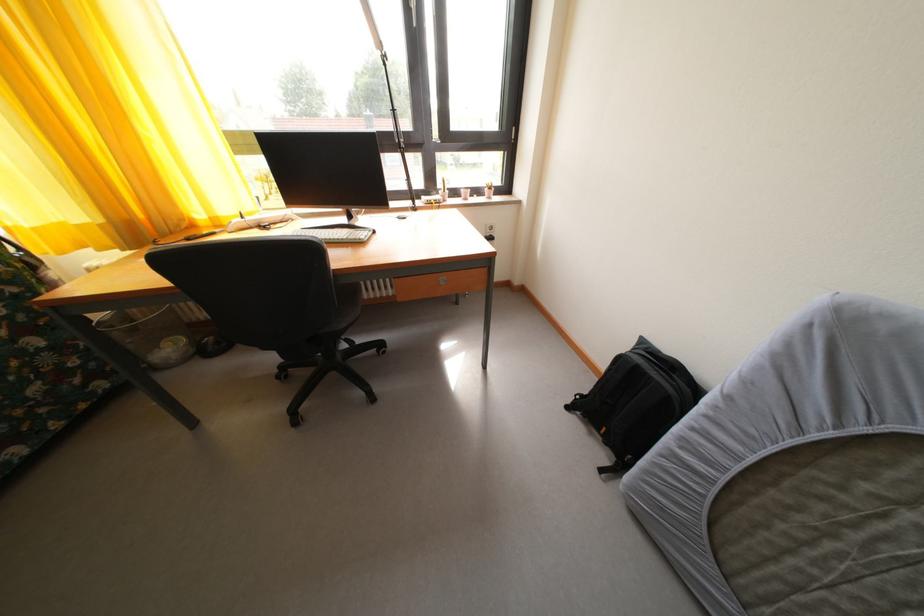
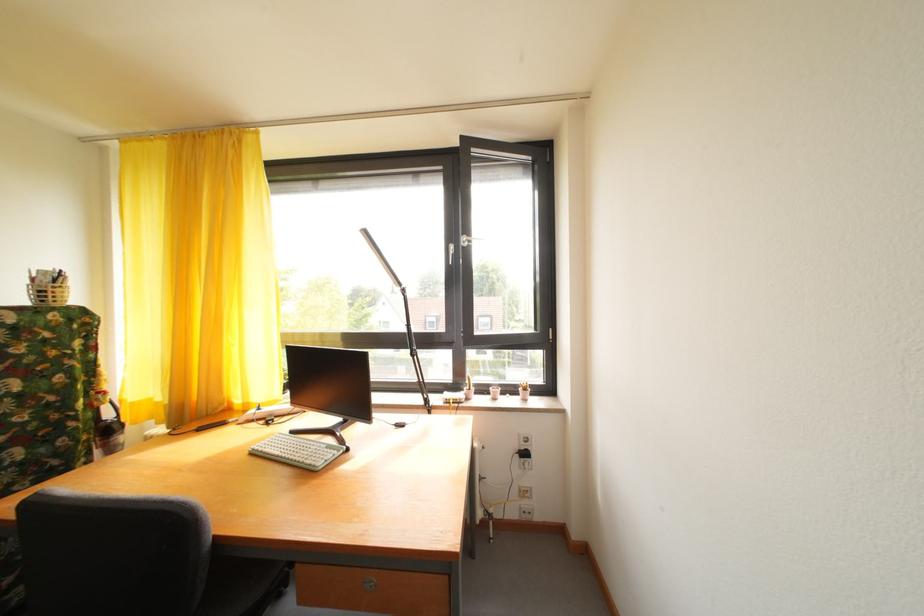
The point at (435, 199) is marked in the first image. Where is the corresponding point in the second image?

(464, 392)